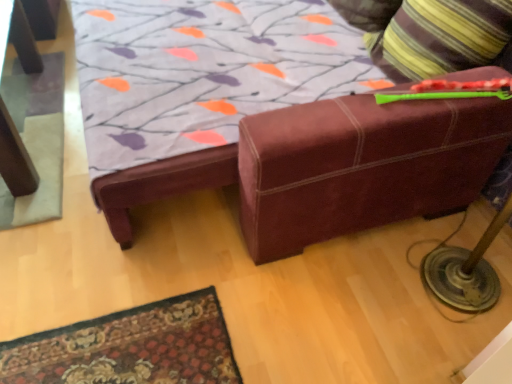
Question: From the image's perspective, is striped fabric pillow at upper right above or below gray felt mat at left?

Choices:
 (A) above
 (B) below

Answer: (A)

Question: Does point (474, 41) appear closer or farther from the camera than point (52, 210)?

Choices:
 (A) farther
 (B) closer

Answer: (B)

Question: Relative to gray felt mat at left, is striped fabric pillow at upper right in front or behind?

Choices:
 (A) front
 (B) behind

Answer: (A)

Question: Is point (32, 92) positioned closer to the camera than point (373, 51)?

Choices:
 (A) farther
 (B) closer

Answer: (A)

Question: From a real-world perspective, relative to striped fabric pillow at upper right, is gray felt mat at left vertically above or below?

Choices:
 (A) above
 (B) below

Answer: (B)

Question: From the image's perspective, is gray felt mat at left located above or below striped fabric pillow at upper right?

Choices:
 (A) below
 (B) above

Answer: (A)

Question: Would you say gray felt mat at left is to the left or to the right of striped fabric pillow at upper right in the picture?

Choices:
 (A) left
 (B) right

Answer: (A)